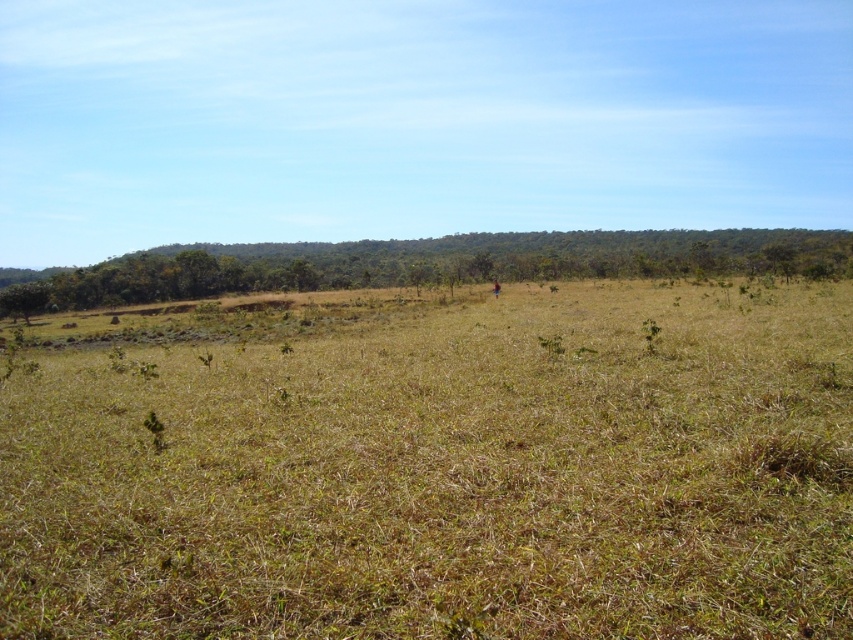
Is brown dry grass at center to the right of green leafy tree at upper center from the viewer's perspective?

No, brown dry grass at center is not to the right of green leafy tree at upper center.

The image size is (853, 640). Identify the location of brown dry grass at center. (445, 476).

Between point (567, 324) and point (679, 237), which one is positioned in front?

Point (567, 324) is more forward.

Where is `brown dry grass at center`? The width and height of the screenshot is (853, 640). brown dry grass at center is located at coordinates (445, 476).